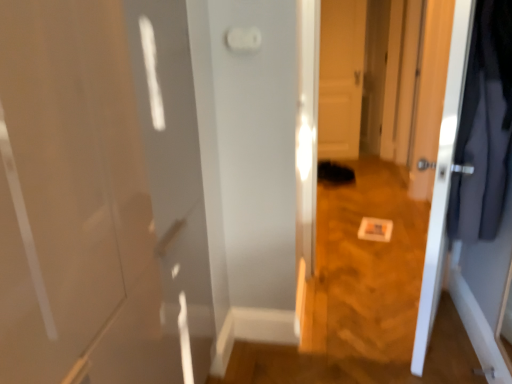
Question: Looking at their shapes, would you say white glossy door at right, which is the second door in back-to-front order, is wider or thinner than white glossy door at center, acting as the first door starting from the back?

Choices:
 (A) wide
 (B) thin

Answer: (A)

Question: In terms of size, does white glossy door at right, which appears as the 1th door when viewed from the front, appear bigger or smaller than white glossy door at center, which appears as the 2th door when viewed from the front?

Choices:
 (A) small
 (B) big

Answer: (B)

Question: Considering the real-world distances, which object is closest to the dark gray fabric coat at right?

Choices:
 (A) white glossy door at right, which appears as the 1th door when viewed from the front
 (B) white glossy door at center, which appears as the 2th door when viewed from the front
 (C) white plastic light switch at upper center

Answer: (A)

Question: Which of these objects is positioned closest to the white plastic light switch at upper center?

Choices:
 (A) dark gray fabric coat at right
 (B) white glossy door at center, acting as the first door starting from the back
 (C) white glossy door at right, which appears as the 1th door when viewed from the front

Answer: (A)